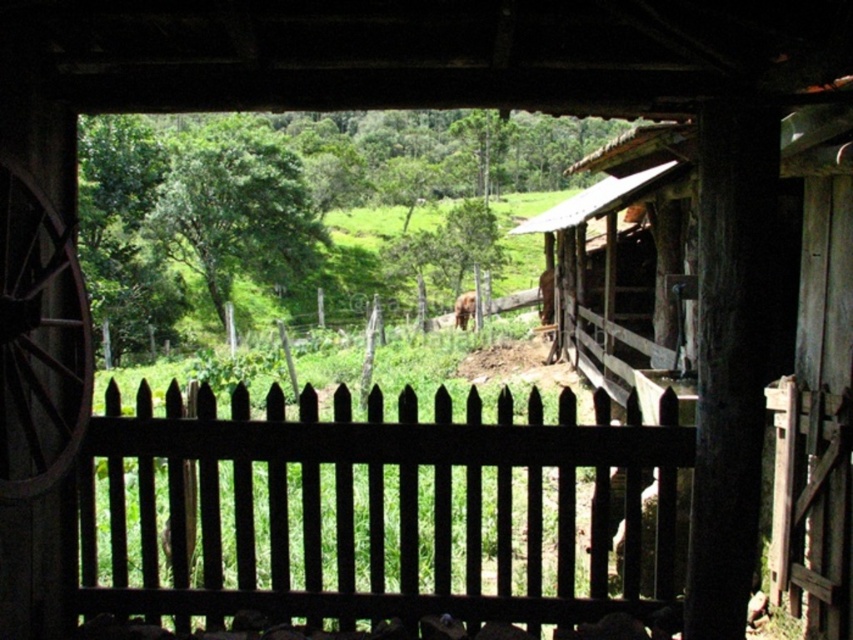
In the scene shown: You are standing inside the rustic wooden structure and want to exit through the doorway. The black wooden fence at center is in your way. Can you walk around it to reach the doorway?

The position of the black wooden fence at center is at point [364,509], so you can walk around it to reach the doorway.